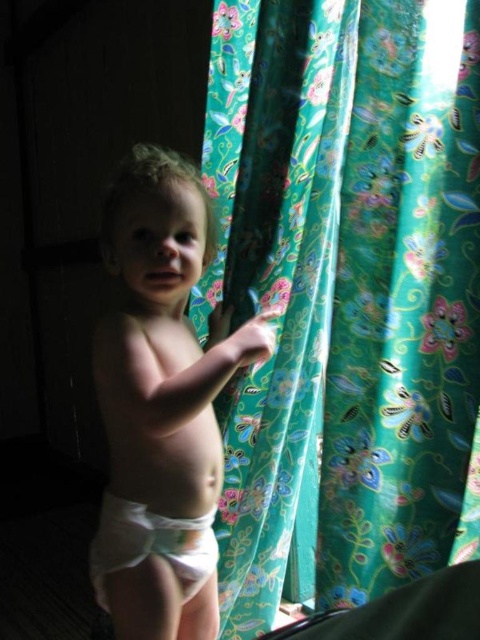
You are a photographer setting up a shoot in this room. You need to ensure that the white cloth diaper at center and the white cloth diaper at lower center are both visible in the frame. Given their sizes, which diaper should you focus on to ensure both are in the shot without moving the camera?

The white cloth diaper at center is much taller than the white cloth diaper at lower center, so focusing on the taller one will help ensure both are visible in the frame without needing to adjust the camera position.

You are a parent trying to choose between two white cloth diapers for your child. You see the white cloth diaper at center and the white cloth diaper at lower center in the image. Which one is wider?

The white cloth diaper at center is wider than the white cloth diaper at lower center.